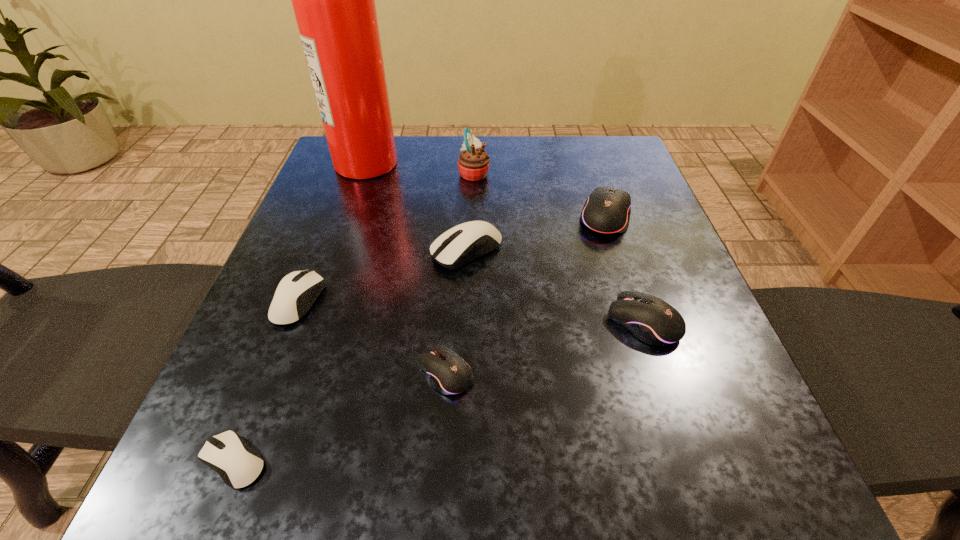
Locate an element on the screen. This screenshot has width=960, height=540. the shortest object is located at coordinates (238, 464).

Locate an element on the screen. the nearest object is located at coordinates (238, 464).

Where is `vacant region located 0.310m at the nozzle of the tallest object`? This screenshot has height=540, width=960. vacant region located 0.310m at the nozzle of the tallest object is located at coordinates (524, 162).

You are a GUI agent. You are given a task and a screenshot of the screen. Output one action in this format:
    pyautogui.click(x=<x>, y=<y>)
    Task: Click on the free space located 0.220m on the front-facing side of the pink muffin
    The width and height of the screenshot is (960, 540).
    Given the screenshot: What is the action you would take?
    pyautogui.click(x=582, y=173)

The width and height of the screenshot is (960, 540). I want to click on free location located on the left of the tallest mouse, so click(426, 217).

You are a GUI agent. You are given a task and a screenshot of the screen. Output one action in this format:
    pyautogui.click(x=<x>, y=<y>)
    Task: Click on the vacant space located 0.060m on the back of the farthest white mouse
    The height and width of the screenshot is (540, 960).
    Given the screenshot: What is the action you would take?
    pyautogui.click(x=468, y=212)

Locate an element on the screen. This screenshot has height=540, width=960. free region located on the back of the second smallest black computer mouse is located at coordinates (611, 226).

Find the location of a particular element. vacant area situated on the right of the second nearest white mouse is located at coordinates (378, 301).

Identify the location of free space located 0.320m on the back of the smallest black computer mouse. This screenshot has height=540, width=960. (455, 222).

At what (x,y) coordinates should I click in order to perform the action: click on vacant space located on the back of the shortest object. Please return your answer as a coordinate pair (x, y). The image size is (960, 540). Looking at the image, I should click on (294, 309).